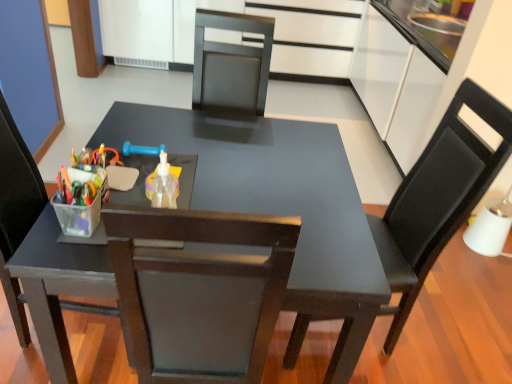
Question: Is matte black chair at left, which is the first chair in left-to-right order, touching white glossy drawer at upper center?

Choices:
 (A) yes
 (B) no

Answer: (B)

Question: Is matte black chair at left, which is the first chair in left-to-right order, at the right side of white glossy drawer at upper center?

Choices:
 (A) no
 (B) yes

Answer: (A)

Question: Is matte black chair at left, which is the first chair in left-to-right order, taller than white glossy drawer at upper center?

Choices:
 (A) yes
 (B) no

Answer: (A)

Question: Can you confirm if matte black chair at left, acting as the second chair starting from the right, is thinner than white glossy drawer at upper center?

Choices:
 (A) yes
 (B) no

Answer: (A)

Question: Is white glossy drawer at upper center surrounded by matte black chair at left, which is the first chair in left-to-right order?

Choices:
 (A) no
 (B) yes

Answer: (A)

Question: Is matte black chair at left, acting as the second chair starting from the right, further to the viewer compared to white glossy drawer at upper center?

Choices:
 (A) yes
 (B) no

Answer: (B)

Question: Is the position of matte black chair at right, which is the first chair from right to left, less distant than that of white glossy drawer at upper center?

Choices:
 (A) yes
 (B) no

Answer: (A)

Question: Is white glossy drawer at upper center surrounded by matte black chair at right, which appears as the 2th chair when viewed from the left?

Choices:
 (A) yes
 (B) no

Answer: (B)

Question: From the image's perspective, does matte black chair at right, which appears as the 2th chair when viewed from the left, appear lower than white glossy drawer at upper center?

Choices:
 (A) no
 (B) yes

Answer: (B)

Question: Is matte black chair at right, which appears as the 2th chair when viewed from the left, not near white glossy drawer at upper center?

Choices:
 (A) yes
 (B) no

Answer: (A)

Question: Considering the relative sizes of matte black chair at right, which is the first chair from right to left, and white glossy drawer at upper center in the image provided, is matte black chair at right, which is the first chair from right to left, taller than white glossy drawer at upper center?

Choices:
 (A) no
 (B) yes

Answer: (B)

Question: Is matte black chair at right, which appears as the 2th chair when viewed from the left, to the left of white glossy drawer at upper center from the viewer's perspective?

Choices:
 (A) no
 (B) yes

Answer: (A)

Question: From a real-world perspective, is matte black chair at left, which is the first chair in left-to-right order, positioned over matte black table at center based on gravity?

Choices:
 (A) no
 (B) yes

Answer: (B)